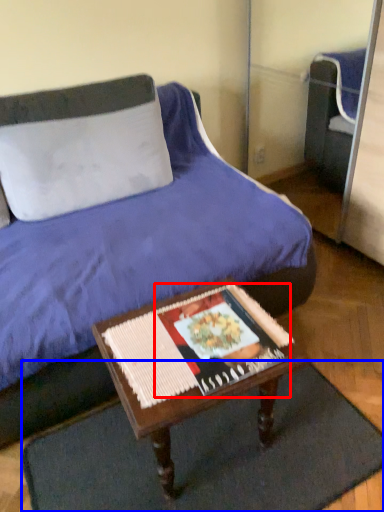
Question: Which object appears farthest to the camera in this image, magazine (highlighted by a red box) or doormat (highlighted by a blue box)?

Choices:
 (A) magazine
 (B) doormat

Answer: (A)